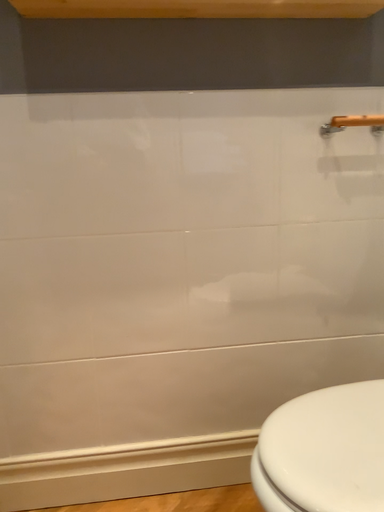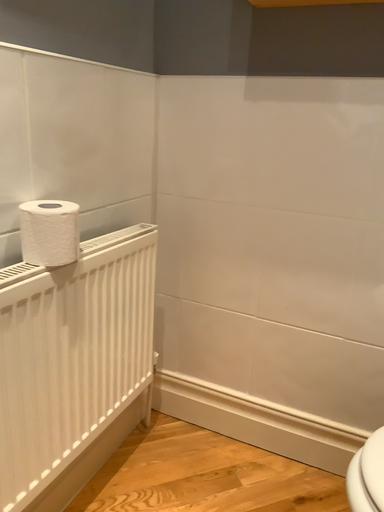
Question: How did the camera likely rotate when shooting the video?

Choices:
 (A) rotated right
 (B) rotated left

Answer: (B)